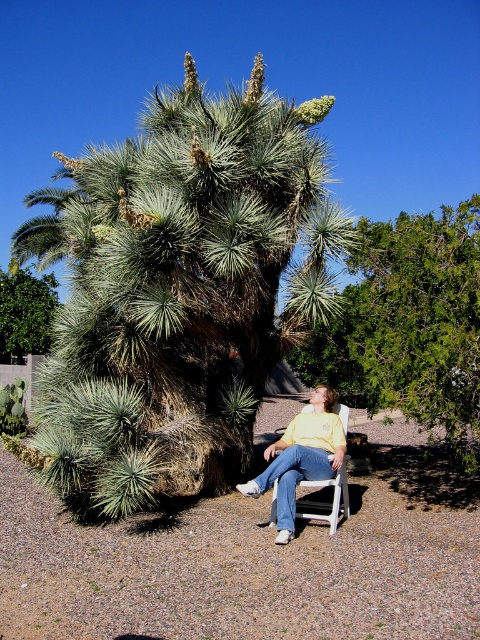
You are standing in front of the green spiky palm tree at center and want to take a photo of it using a camera that has a maximum focus range of 5 meters. Can you capture the tree clearly without moving closer?

The green spiky palm tree at center is 4.87 meters away from camera, so yes, the camera can focus on it clearly since the distance is within the 5 meters maximum focus range.